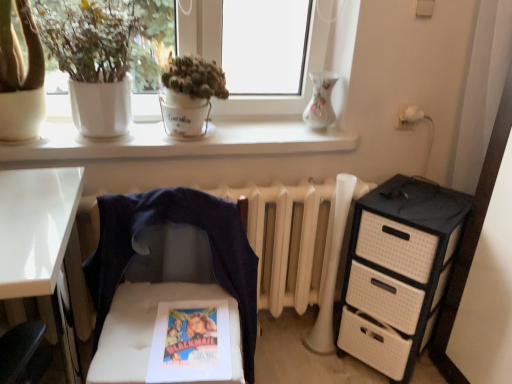
Question: Considering the relative sizes of green matte pot at upper center, the second houseplant from the left, and porcelain vase at upper center in the image provided, is green matte pot at upper center, the second houseplant from the left, thinner than porcelain vase at upper center?

Choices:
 (A) no
 (B) yes

Answer: (A)

Question: Is green matte pot at upper center, the second houseplant from the left, looking in the opposite direction of porcelain vase at upper center?

Choices:
 (A) no
 (B) yes

Answer: (A)

Question: From the image's perspective, is green matte pot at upper center, the second houseplant from the left, below porcelain vase at upper center?

Choices:
 (A) no
 (B) yes

Answer: (B)

Question: Is green matte pot at upper center, which is the 1th houseplant from right to left, not inside porcelain vase at upper center?

Choices:
 (A) yes
 (B) no

Answer: (A)

Question: Are green matte pot at upper center, which is the 1th houseplant from right to left, and porcelain vase at upper center beside each other?

Choices:
 (A) yes
 (B) no

Answer: (B)

Question: From the image's perspective, is white matte pot at upper left, the first houseplant when ordered from left to right, located above or below white tufted chair at center?

Choices:
 (A) below
 (B) above

Answer: (B)

Question: Relative to white tufted chair at center, is white matte pot at upper left, marked as the second houseplant in a right-to-left arrangement, in front or behind?

Choices:
 (A) behind
 (B) front

Answer: (A)

Question: Considering the positions of white matte pot at upper left, marked as the second houseplant in a right-to-left arrangement, and white tufted chair at center in the image, is white matte pot at upper left, marked as the second houseplant in a right-to-left arrangement, bigger or smaller than white tufted chair at center?

Choices:
 (A) big
 (B) small

Answer: (B)

Question: Is point (71, 46) positioned closer to the camera than point (231, 350)?

Choices:
 (A) closer
 (B) farther

Answer: (B)

Question: Is matte paper comic book at center in front of or behind white matte window sill at upper center in the image?

Choices:
 (A) behind
 (B) front

Answer: (B)

Question: Visually, is matte paper comic book at center positioned to the left or to the right of white matte window sill at upper center?

Choices:
 (A) left
 (B) right

Answer: (B)

Question: From a real-world perspective, is matte paper comic book at center above or below white matte window sill at upper center?

Choices:
 (A) below
 (B) above

Answer: (A)

Question: From the image's perspective, is matte paper comic book at center located above or below white matte window sill at upper center?

Choices:
 (A) below
 (B) above

Answer: (A)

Question: From the image's perspective, is black textured chest of drawers at right positioned above or below white matte window sill at upper center?

Choices:
 (A) below
 (B) above

Answer: (A)

Question: Is black textured chest of drawers at right bigger or smaller than white matte window sill at upper center?

Choices:
 (A) big
 (B) small

Answer: (A)